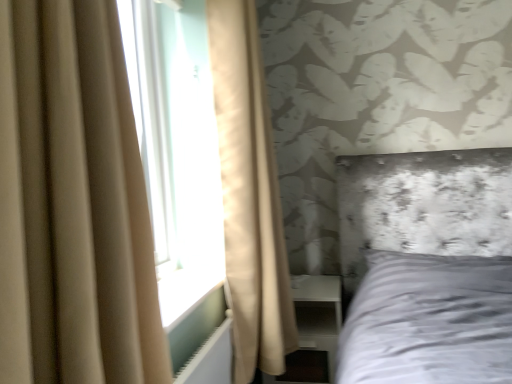
Question: From their relative heights in the image, would you say white plastic radiator at lower left is taller or shorter than beige fabric curtain at left, the first curtain in the front-to-back sequence?

Choices:
 (A) tall
 (B) short

Answer: (B)

Question: Visually, is white plastic radiator at lower left positioned to the left or to the right of beige fabric curtain at left, the first curtain in the front-to-back sequence?

Choices:
 (A) left
 (B) right

Answer: (B)

Question: Estimate the real-world distances between objects in this image. Which object is closer to the white plastic radiator at lower left?

Choices:
 (A) beige fabric curtain at left, arranged as the 2th curtain when viewed from the back
 (B) white glossy dresser at lower right
 (C) beige fabric curtain at left, positioned as the second curtain in front-to-back order

Answer: (C)

Question: Which object is positioned closest to the white plastic radiator at lower left?

Choices:
 (A) beige fabric curtain at left, the first curtain in the front-to-back sequence
 (B) white glossy dresser at lower right
 (C) beige fabric curtain at left, positioned as the second curtain in front-to-back order

Answer: (C)